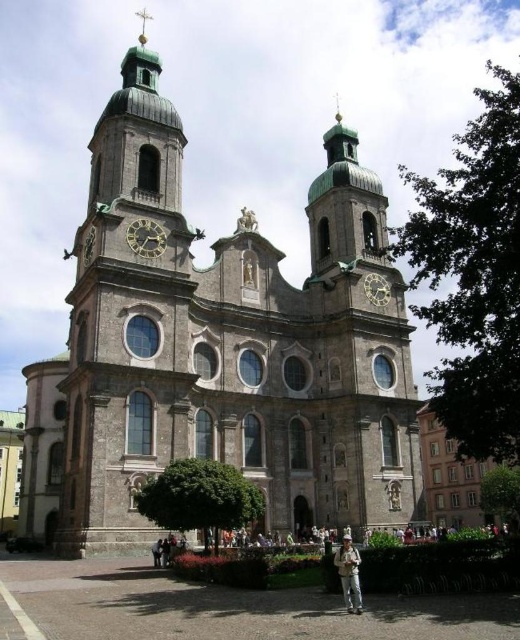
You are standing in the plaza in front of the church and notice two points marked on the ground. The first point is at coordinate point (117, 200) and the second is at point (145, 26). Which point is closer to your current position?

Point (117, 200) is closer to the camera than point (145, 26), so the first point is closer to your current position.

You are a photographer planning to take a picture of the polished brass clock at center and the khaki fabric jacket at lower center. Which object should you focus on first if you want to capture both in a single frame without moving the camera?

You should focus on the polished brass clock at center first because the khaki fabric jacket at lower center is larger in size, so it will require more attention to detail to ensure it fits well within the frame.